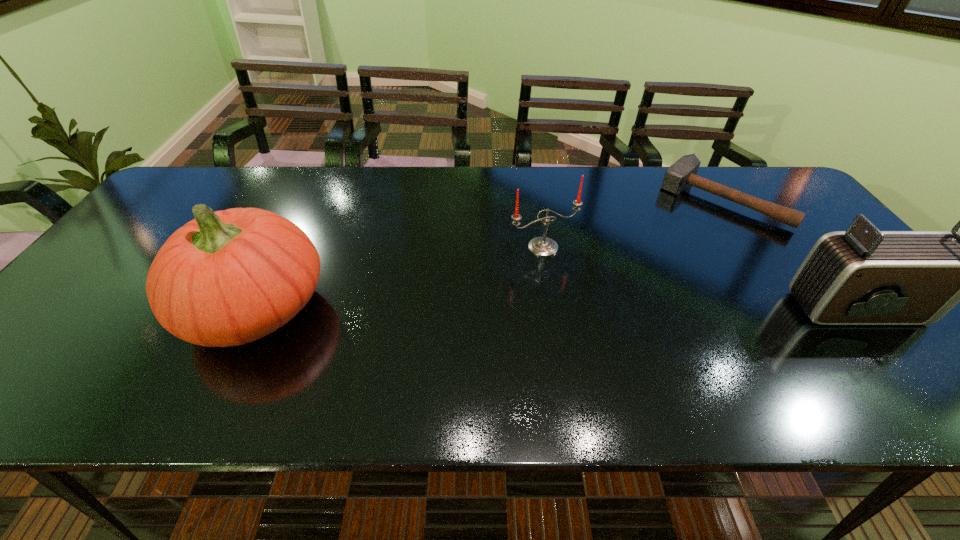
At what (x,y) coordinates should I click in order to perform the action: click on the leftmost object. Please return your answer as a coordinate pair (x, y). Looking at the image, I should click on (226, 278).

The image size is (960, 540). I want to click on the shortest object, so tap(682, 173).

Identify the location of the farthest object. Image resolution: width=960 pixels, height=540 pixels. (682, 173).

In order to click on the second object from left to right in this screenshot , I will do `click(543, 246)`.

The height and width of the screenshot is (540, 960). I want to click on candle, so click(543, 246).

The height and width of the screenshot is (540, 960). In order to click on blank space located 0.260m on the left of the leftmost object in this screenshot , I will do `click(73, 308)`.

You are a GUI agent. You are given a task and a screenshot of the screen. Output one action in this format:
    pyautogui.click(x=<x>, y=<y>)
    Task: Click on the free space located on the striking surface of the shortest object
    This screenshot has height=540, width=960.
    Given the screenshot: What is the action you would take?
    pyautogui.click(x=681, y=242)

Identify the location of blank space located on the striking surface of the shortest object. (658, 266).

This screenshot has width=960, height=540. I want to click on vacant space located 0.070m on the striking surface of the shortest object, so click(686, 236).

In order to click on free location located on the front-facing side of the second shortest object in this screenshot , I will do `click(639, 359)`.